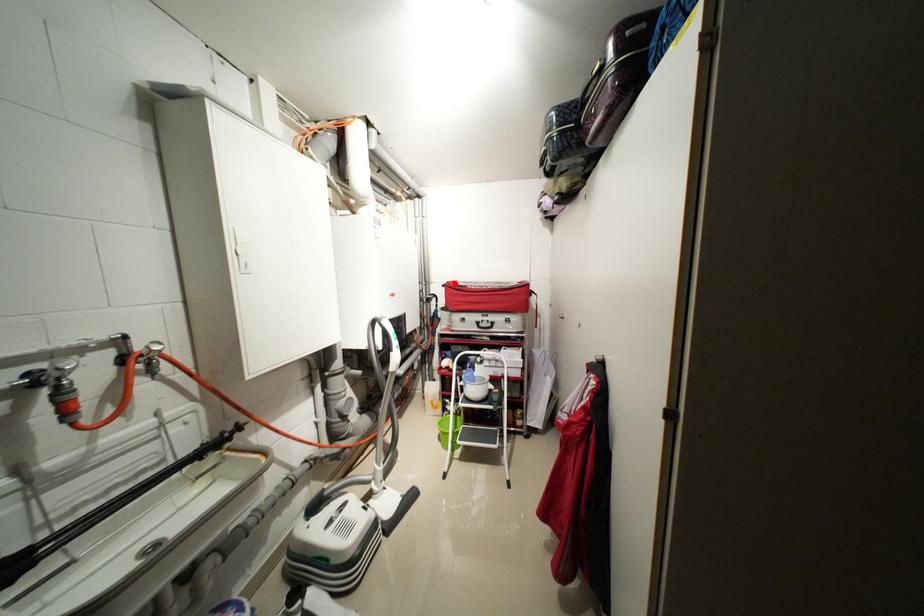
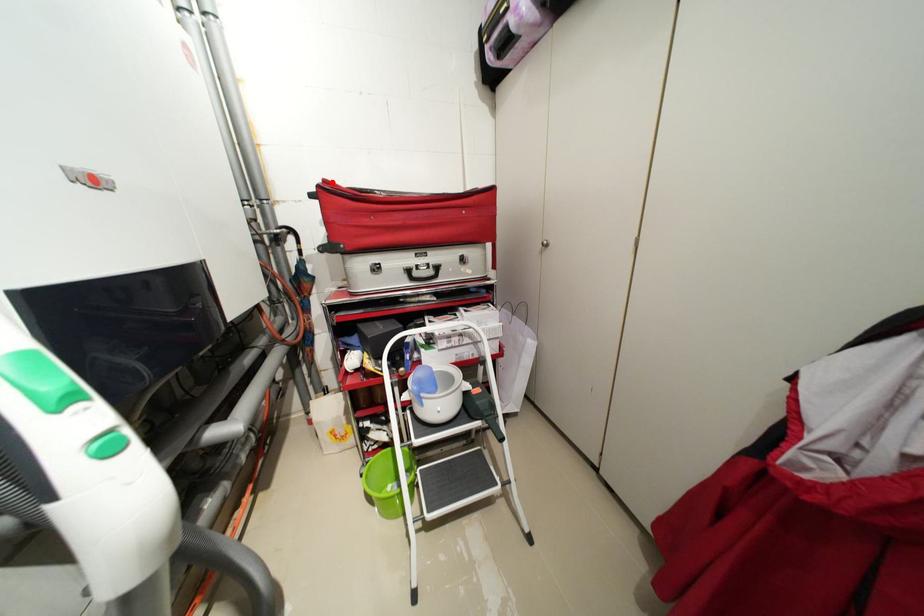
I am providing you with two images of the same scene from different viewpoints. A red point is marked on the first image and another point is marked on the second image. Are the points marked in image1 and image2 representing the same 3D position?

Yes